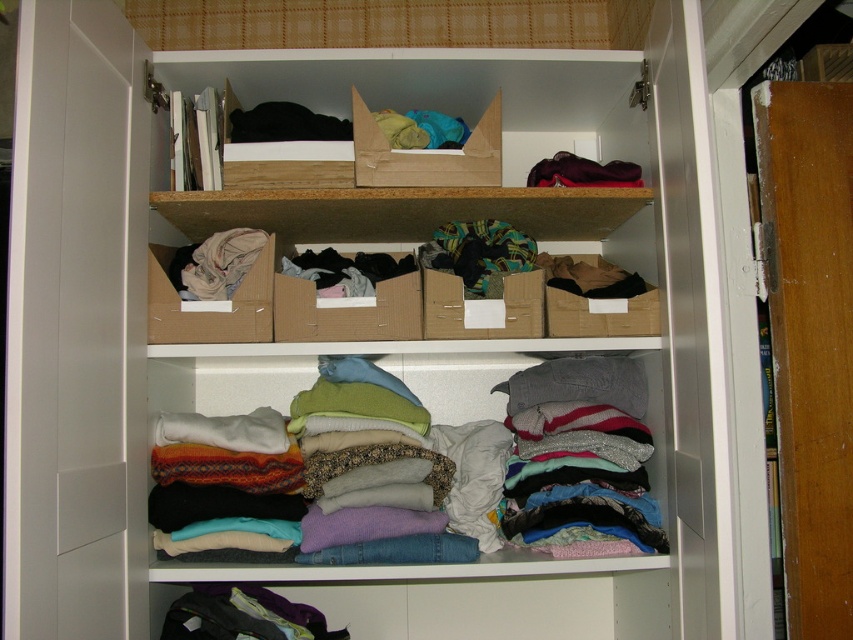
You are trying to reach the dark purple fabric at upper center in the wardrobe but there is a cardboard box at center in the way. Can you move the box to access the fabric?

The distance between the cardboard box at center and the dark purple fabric at upper center is 10.17 inches. If you can move the box aside, you can access the fabric.

You are organizing your wardrobe and notice two fabrics, the black fabric at upper center and the dark purple fabric at upper center. How far apart are they?

The black fabric at upper center is 16.00 inches from the dark purple fabric at upper center.

Looking at this image, you are trying to reach the dark purple fabric at upper center in the wardrobe. Is the cardboard box at center blocking your access to it?

The cardboard box at center is in front of the dark purple fabric at upper center, so yes, the cardboard box at center is blocking access to the dark purple fabric at upper center.